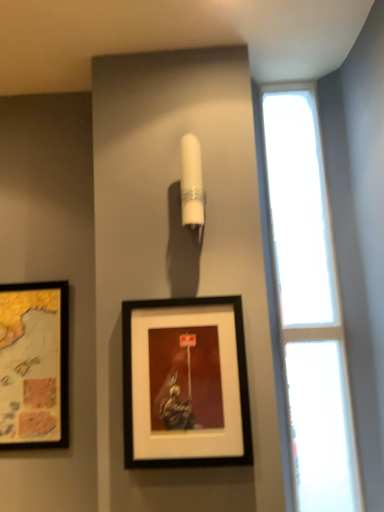
Question: Can you confirm if transparent glass window at right is positioned to the left of black matte picture frame at center, acting as the 1th picture frame starting from the front?

Choices:
 (A) yes
 (B) no

Answer: (B)

Question: Does transparent glass window at right have a lesser width compared to black matte picture frame at center, the 1th picture frame when ordered from right to left?

Choices:
 (A) no
 (B) yes

Answer: (A)

Question: Is transparent glass window at right closer to camera compared to black matte picture frame at center, the 1th picture frame when ordered from right to left?

Choices:
 (A) yes
 (B) no

Answer: (B)

Question: Can you confirm if transparent glass window at right is shorter than black matte picture frame at center, the 2th picture frame viewed from the left?

Choices:
 (A) no
 (B) yes

Answer: (A)

Question: Is transparent glass window at right to the right of black matte picture frame at center, acting as the 1th picture frame starting from the front, from the viewer's perspective?

Choices:
 (A) yes
 (B) no

Answer: (A)

Question: Considering the positions of black matte picture frame at center, acting as the 1th picture frame starting from the front, and matte black picture frame at left, which is the second picture frame from right to left, in the image, is black matte picture frame at center, acting as the 1th picture frame starting from the front, bigger or smaller than matte black picture frame at left, which is the second picture frame from right to left,?

Choices:
 (A) big
 (B) small

Answer: (A)

Question: Which is correct: black matte picture frame at center, the 2th picture frame viewed from the left, is inside matte black picture frame at left, acting as the first picture frame starting from the back, or outside of it?

Choices:
 (A) outside
 (B) inside

Answer: (A)

Question: From their relative heights in the image, would you say black matte picture frame at center, acting as the 1th picture frame starting from the front, is taller or shorter than matte black picture frame at left, which is counted as the 1th picture frame, starting from the left?

Choices:
 (A) short
 (B) tall

Answer: (A)

Question: Is point (243, 431) closer or farther from the camera than point (26, 342)?

Choices:
 (A) farther
 (B) closer

Answer: (B)

Question: In terms of height, does black matte picture frame at center, the 2th picture frame viewed from the left, look taller or shorter compared to transparent glass window at right?

Choices:
 (A) short
 (B) tall

Answer: (A)

Question: Considering their positions, is black matte picture frame at center, acting as the 1th picture frame starting from the front, located in front of or behind transparent glass window at right?

Choices:
 (A) behind
 (B) front

Answer: (B)

Question: From the image's perspective, relative to transparent glass window at right, is black matte picture frame at center, the 2th picture frame viewed from the left, above or below?

Choices:
 (A) above
 (B) below

Answer: (B)

Question: Visually, is black matte picture frame at center, the 1th picture frame when ordered from right to left, positioned to the left or to the right of transparent glass window at right?

Choices:
 (A) right
 (B) left

Answer: (B)

Question: Is transparent glass window at right inside or outside of matte black picture frame at left, positioned as the second picture frame in front-to-back order?

Choices:
 (A) inside
 (B) outside

Answer: (B)

Question: Is transparent glass window at right in front of or behind matte black picture frame at left, positioned as the second picture frame in front-to-back order, in the image?

Choices:
 (A) behind
 (B) front

Answer: (B)